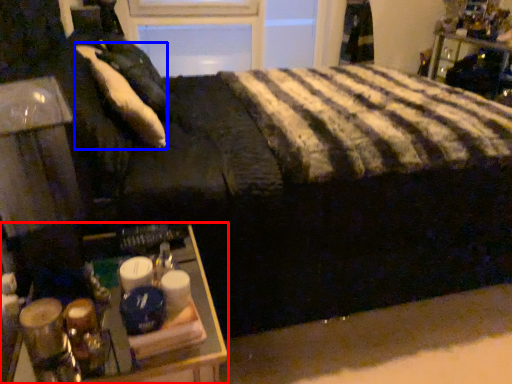
Question: Which object is further to the camera taking this photo, table (highlighted by a red box) or pillow (highlighted by a blue box)?

Choices:
 (A) table
 (B) pillow

Answer: (B)